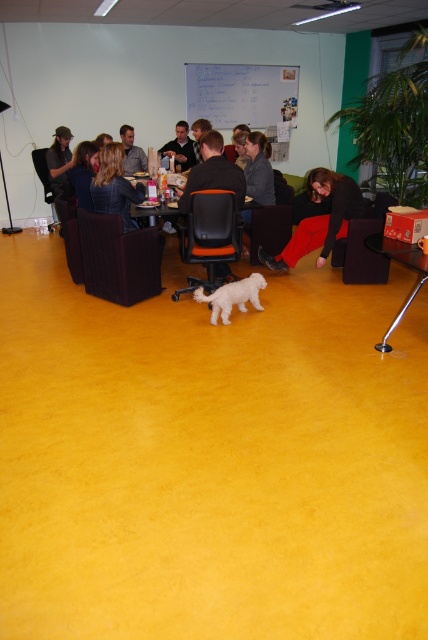
Question: Is denim jacket at center closer to camera compared to matte black shirt at center?

Choices:
 (A) no
 (B) yes

Answer: (B)

Question: Which of the following is the closest to the observer?

Choices:
 (A) (131, 154)
 (B) (291, 237)
 (C) (83, 172)

Answer: (C)

Question: Which point is closer to the camera taking this photo?

Choices:
 (A) (332, 172)
 (B) (36, 148)

Answer: (A)

Question: Which of these objects is positioned farthest from the matte black shirt at left?

Choices:
 (A) matte gray shirt at center
 (B) black leather chair at left

Answer: (B)

Question: Is matte black shirt at left positioned before matte gray shirt at center?

Choices:
 (A) no
 (B) yes

Answer: (B)

Question: Does matte black jacket at lower center have a greater width compared to orange fabric chair at center?

Choices:
 (A) no
 (B) yes

Answer: (B)